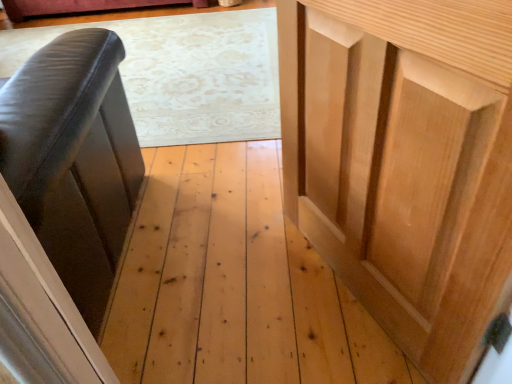
Find the location of a particular element. The image size is (512, 384). natural wood cupboard at right is located at coordinates (405, 162).

Describe the element at coordinates (405, 162) in the screenshot. This screenshot has height=384, width=512. I see `natural wood cupboard at right` at that location.

Image resolution: width=512 pixels, height=384 pixels. Identify the location of black leather couch at left. (63, 205).

Measure the distance between black leather couch at left and camera.

22.27 inches.

The width and height of the screenshot is (512, 384). What do you see at coordinates (63, 205) in the screenshot?
I see `black leather couch at left` at bounding box center [63, 205].

At what (x,y) coordinates should I click in order to perform the action: click on natural wood cupboard at right. Please return your answer as a coordinate pair (x, y). Looking at the image, I should click on (405, 162).

In the scene shown: In the image, is black leather couch at left on the left side or the right side of natural wood cupboard at right?

black leather couch at left is positioned on natural wood cupboard at right's left side.

Which object is closer to the camera, black leather couch at left or natural wood cupboard at right?

Positioned in front is natural wood cupboard at right.

Is point (111, 106) behind point (507, 167)?

Yes, it is behind point (507, 167).

From the image's perspective, who appears lower, black leather couch at left or natural wood cupboard at right?

natural wood cupboard at right appears lower in the image.

From a real-world perspective, is black leather couch at left positioned over natural wood cupboard at right based on gravity?

Yes, from a real-world perspective, black leather couch at left is over natural wood cupboard at right

Considering the relative sizes of black leather couch at left and natural wood cupboard at right in the image provided, is black leather couch at left thinner than natural wood cupboard at right?

No.

Looking at this image, is black leather couch at left taller than natural wood cupboard at right?

Yes, black leather couch at left is taller than natural wood cupboard at right.

Which of these two, black leather couch at left or natural wood cupboard at right, is bigger?

black leather couch at left.

Is black leather couch at left located outside natural wood cupboard at right?

That's correct, black leather couch at left is outside of natural wood cupboard at right.

Are black leather couch at left and natural wood cupboard at right located far from each other?

No.

Is black leather couch at left turned away from natural wood cupboard at right?

black leather couch at left does not have its back to natural wood cupboard at right.

What's the angular difference between black leather couch at left and natural wood cupboard at right's facing directions?

66 degrees.

Measure the distance from black leather couch at left to natural wood cupboard at right.

black leather couch at left is 26.29 inches from natural wood cupboard at right.

Locate an element on the screen. This screenshot has width=512, height=384. cupboard below the black leather couch at left (from a real-world perspective) is located at coordinates (405, 162).

Considering the relative positions of natural wood cupboard at right and black leather couch at left in the image provided, is natural wood cupboard at right to the left of black leather couch at left from the viewer's perspective?

In fact, natural wood cupboard at right is to the right of black leather couch at left.

Is natural wood cupboard at right in front of black leather couch at left?

Yes, it is.

Which point is more distant from viewer, [431,258] or [8,117]?

Positioned behind is point [8,117].

From the image's perspective, would you say natural wood cupboard at right is positioned over black leather couch at left?

No.

From a real-world perspective, is natural wood cupboard at right positioned under black leather couch at left based on gravity?

Yes.

Which object is thinner, natural wood cupboard at right or black leather couch at left?

With smaller width is natural wood cupboard at right.

Considering the sizes of natural wood cupboard at right and black leather couch at left in the image, is natural wood cupboard at right taller or shorter than black leather couch at left?

Clearly, natural wood cupboard at right is shorter compared to black leather couch at left.

Considering the sizes of natural wood cupboard at right and black leather couch at left in the image, is natural wood cupboard at right bigger or smaller than black leather couch at left?

natural wood cupboard at right is smaller than black leather couch at left.

Is natural wood cupboard at right inside or outside of black leather couch at left?

natural wood cupboard at right is located beyond the bounds of black leather couch at left.

Based on the photo, is natural wood cupboard at right placed right next to black leather couch at left?

No, natural wood cupboard at right is not next to black leather couch at left.

Is natural wood cupboard at right oriented towards black leather couch at left?

No.

At what (x,y) coordinates should I click in order to perform the action: click on furniture that is on the left side of natural wood cupboard at right. Please return your answer as a coordinate pair (x, y). This screenshot has height=384, width=512. Looking at the image, I should click on (63, 205).

Identify the location of furniture above the natural wood cupboard at right (from a real-world perspective). This screenshot has height=384, width=512. (63, 205).

At what (x,y) coordinates should I click in order to perform the action: click on furniture lying behind the natural wood cupboard at right. Please return your answer as a coordinate pair (x, y). This screenshot has width=512, height=384. Looking at the image, I should click on pyautogui.click(x=63, y=205).